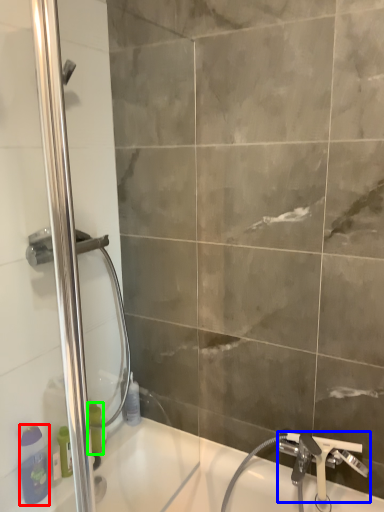
Question: Which is farther away from toiletry (highlighted by a red box)? tap (highlighted by a blue box) or toiletry (highlighted by a green box)?

Choices:
 (A) tap
 (B) toiletry

Answer: (A)